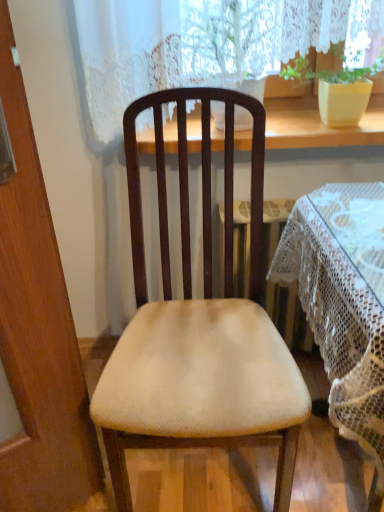
Question: Does point (155, 356) appear closer or farther from the camera than point (380, 61)?

Choices:
 (A) farther
 (B) closer

Answer: (B)

Question: From their relative heights in the image, would you say beige fabric chair at center is taller or shorter than matte yellow pot at upper right?

Choices:
 (A) short
 (B) tall

Answer: (B)

Question: Estimate the real-world distances between objects in this image. Which object is farther from the beige fabric chair at center?

Choices:
 (A) white lace tablecloth at center
 (B) matte yellow pot at upper right
 (C) wooden at upper center

Answer: (B)

Question: Considering the real-world distances, which object is closest to the beige fabric chair at center?

Choices:
 (A) wooden at upper center
 (B) matte yellow pot at upper right
 (C) white lace tablecloth at center

Answer: (C)